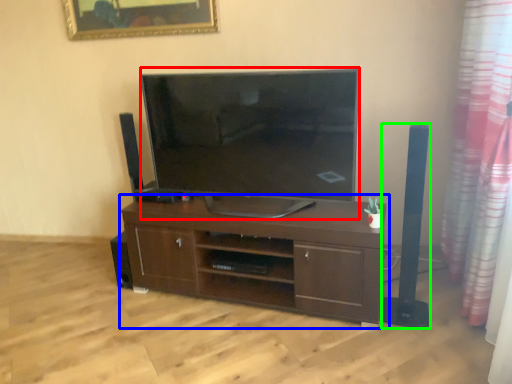
Question: Considering the real-world distances, which object is closest to television (highlighted by a red box)? cabinetry (highlighted by a blue box) or speaker (highlighted by a green box).

Choices:
 (A) cabinetry
 (B) speaker

Answer: (A)